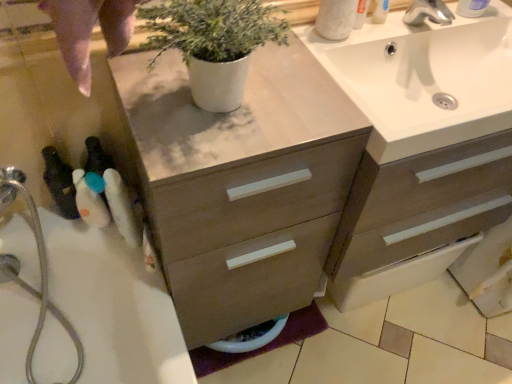
Question: Is point (425, 13) positioned closer to the camera than point (470, 1)?

Choices:
 (A) closer
 (B) farther

Answer: (A)

Question: In the image, is silver metallic faucet at upper right on the left side or the right side of white plastic soap dispenser at upper right, the fourth toiletry when ordered from bottom to top?

Choices:
 (A) right
 (B) left

Answer: (B)

Question: Which of these objects is positioned closest to the black plastic toothbrushes at left, marked as the fourth toiletry in a right-to-left arrangement?

Choices:
 (A) white glossy pot at center
 (B) silver metallic faucet at upper right
 (C) white matte toilet paper at upper right
 (D) silvery metallic garden hose at lower left
 (E) white plastic bottle at lower left, which is counted as the 2th toiletry, starting from the left

Answer: (E)

Question: Estimate the real-world distances between objects in this image. Which object is farther from the white fluffy brush at left, positioned as the 2th toiletry in right-to-left order?

Choices:
 (A) silver metallic faucet at upper right
 (B) white glossy pot at center
 (C) white plastic bottle at lower left, which is the second toiletry from bottom to top
 (D) black plastic toothbrushes at left, the 1th toiletry positioned from the left
 (E) white glossy sink at upper right

Answer: (A)